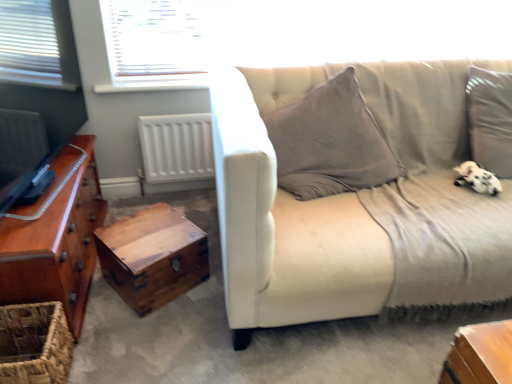
Locate an element on the screen. This screenshot has width=512, height=384. vacant space situated above wooden chest at lower left (from a real-world perspective) is located at coordinates (157, 229).